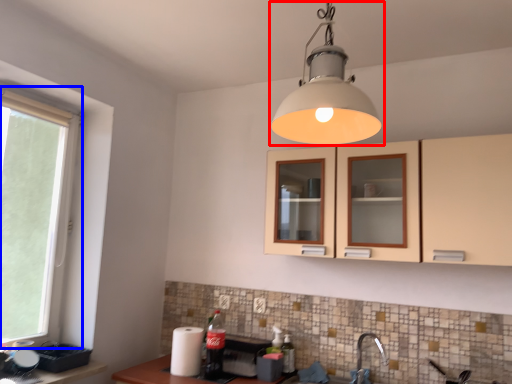
Question: Which object appears farthest to the camera in this image, lamp (highlighted by a red box) or window (highlighted by a blue box)?

Choices:
 (A) lamp
 (B) window

Answer: (B)